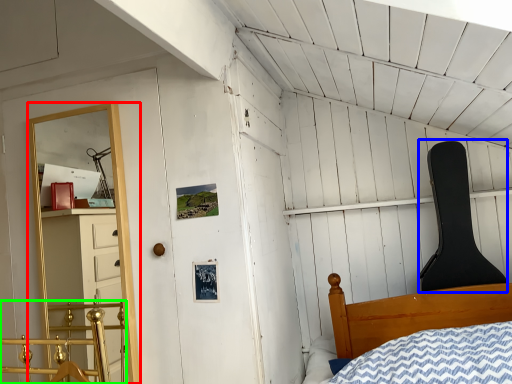
Question: Estimate the real-world distances between objects in this image. Which object is farther from shelf (highlighted by a red box), chair (highlighted by a blue box) or rail (highlighted by a green box)?

Choices:
 (A) chair
 (B) rail

Answer: (A)